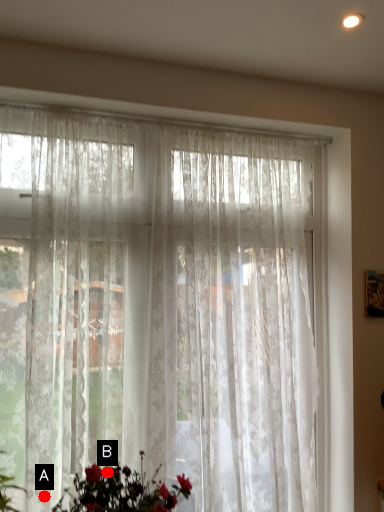
Question: Two points are circled on the image, labeled by A and B beside each circle. Which point is closer to the camera taking this photo?

Choices:
 (A) A is closer
 (B) B is closer

Answer: (B)